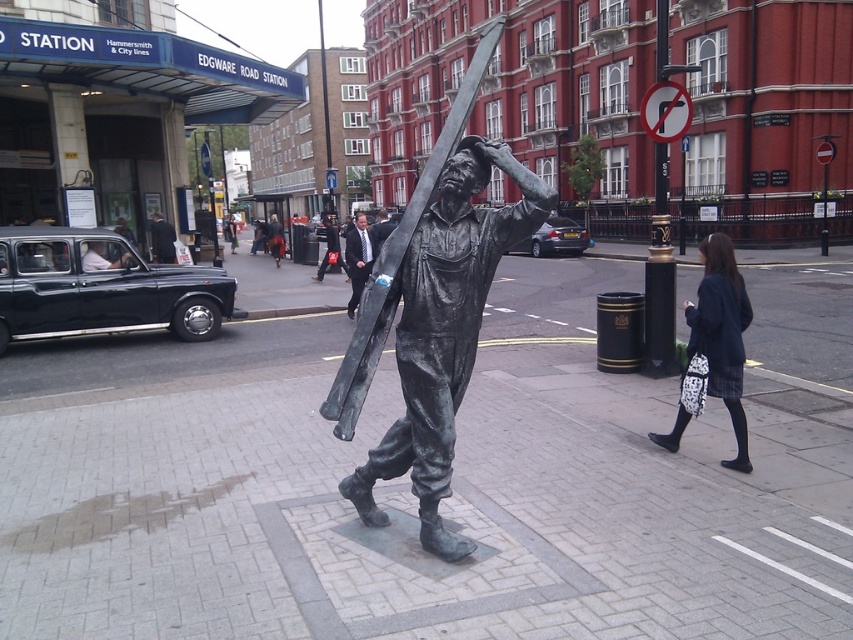
Which is below, dark blue wool coat at center right or bronze post at center?

dark blue wool coat at center right is lower down.

Find the location of a particular element. The height and width of the screenshot is (640, 853). dark blue wool coat at center right is located at coordinates (721, 333).

Identify the location of dark blue wool coat at center right. The height and width of the screenshot is (640, 853). (721, 333).

Between bronze statue at center and bronze post at center, which one is positioned higher?

bronze statue at center is above.

This screenshot has width=853, height=640. In order to click on bronze statue at center in this screenshot , I will do pyautogui.click(x=433, y=310).

Identify the location of bronze statue at center. Image resolution: width=853 pixels, height=640 pixels. (433, 310).

The width and height of the screenshot is (853, 640). I want to click on bronze statue at center, so click(x=433, y=310).

Is point (344, 360) farther from viewer compared to point (364, 244)?

No, (344, 360) is closer to viewer.

Is bronze statue at center above dark suit at center?

Indeed, bronze statue at center is positioned over dark suit at center.

Is point (550, 189) positioned after point (368, 230)?

No, (550, 189) is in front of (368, 230).

The width and height of the screenshot is (853, 640). Find the location of `bronze statue at center`. bronze statue at center is located at coordinates (433, 310).